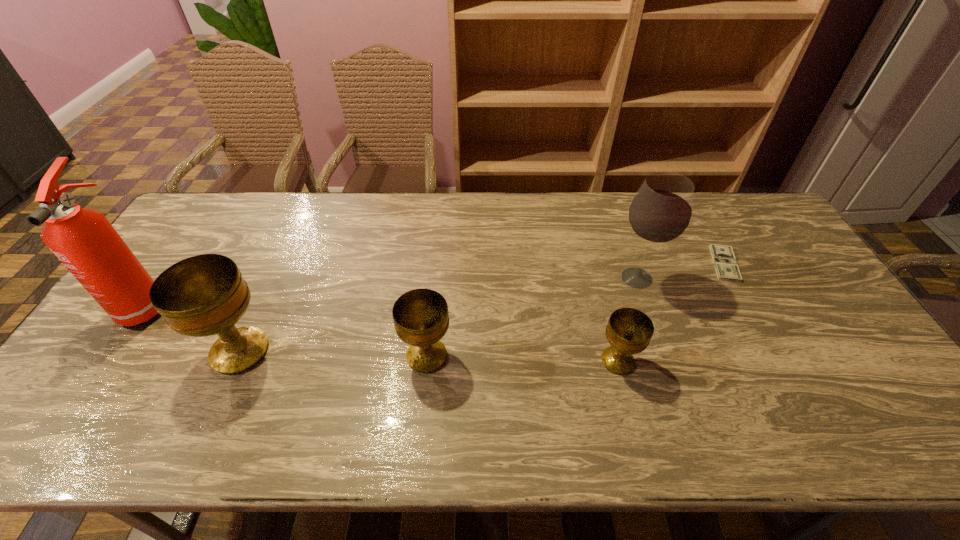
Please point a spot to add another chalice on the right. Please provide its 2D coordinates. Your answer should be formatted as a tuple, i.e. [(x, y)], where the tuple contains the x and y coordinates of a point satisfying the conditions above.

[(812, 366)]